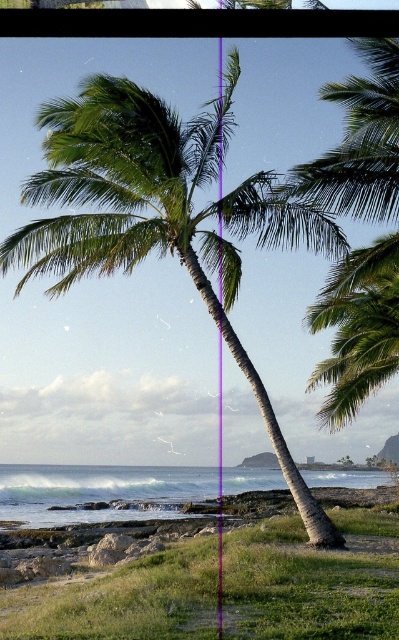
You are standing at the point marked by the coordinates point (158, 218) in the coastal scene. Which object are you directly at?

The point (158, 218) indicates the green leafy coconut tree at center.

You are standing on the beach and see the green leafy coconut tree at center and the clear water at lower center. Which object is closer to the ground level?

The clear water at lower center is closer to the ground level since it is located below the green leafy coconut tree at center.

You are standing at the edge of the beach looking towards the ocean. You see a green leafy coconut tree at center and clear water at lower center. Which object is positioned to the left of the other?

The green leafy coconut tree at center is to the left of clear water at lower center.